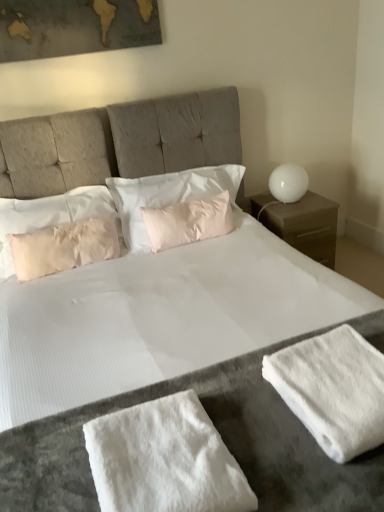
Question: Should I look upward or downward to see pink textured pillow at center, which is the 3th pillow from left to right?

Choices:
 (A) up
 (B) down

Answer: (A)

Question: Should I look upward or downward to see white matte table lamp at right?

Choices:
 (A) down
 (B) up

Answer: (B)

Question: Is white matte nightstand at right at the right side of pink fabric pillow at upper left, placed as the third pillow when sorted from right to left?

Choices:
 (A) yes
 (B) no

Answer: (A)

Question: Is white matte nightstand at right positioned behind pink fabric pillow at upper left, which is the first pillow in left-to-right order?

Choices:
 (A) yes
 (B) no

Answer: (A)

Question: Would you consider white matte nightstand at right to be distant from pink fabric pillow at upper left, placed as the third pillow when sorted from right to left?

Choices:
 (A) no
 (B) yes

Answer: (B)

Question: Is white matte nightstand at right closer to camera compared to pink fabric pillow at upper left, which is the first pillow in left-to-right order?

Choices:
 (A) no
 (B) yes

Answer: (A)

Question: Is white matte nightstand at right smaller than pink fabric pillow at upper left, placed as the third pillow when sorted from right to left?

Choices:
 (A) no
 (B) yes

Answer: (A)

Question: From a real-world perspective, is white matte nightstand at right located beneath pink fabric pillow at upper left, which is the first pillow in left-to-right order?

Choices:
 (A) yes
 (B) no

Answer: (A)

Question: From a real-world perspective, is white matte nightstand at right positioned under pink textured pillow at center, which is the 3th pillow from left to right, based on gravity?

Choices:
 (A) yes
 (B) no

Answer: (A)

Question: Considering the relative sizes of white matte nightstand at right and pink textured pillow at center, the first pillow when ordered from right to left, in the image provided, is white matte nightstand at right smaller than pink textured pillow at center, the first pillow when ordered from right to left,?

Choices:
 (A) yes
 (B) no

Answer: (B)

Question: Considering the relative sizes of white matte nightstand at right and pink textured pillow at center, the first pillow when ordered from right to left, in the image provided, is white matte nightstand at right thinner than pink textured pillow at center, the first pillow when ordered from right to left,?

Choices:
 (A) no
 (B) yes

Answer: (A)

Question: From a real-world perspective, is white matte nightstand at right physically above pink textured pillow at center, the first pillow when ordered from right to left?

Choices:
 (A) yes
 (B) no

Answer: (B)

Question: Can you confirm if white matte nightstand at right is bigger than pink textured pillow at center, the first pillow when ordered from right to left?

Choices:
 (A) no
 (B) yes

Answer: (B)

Question: Can you see white matte nightstand at right touching pink textured pillow at center, the first pillow when ordered from right to left?

Choices:
 (A) no
 (B) yes

Answer: (A)

Question: Is pink textured pillow at center, which is the 3th pillow from left to right, turned away from pink satin pillow at center, which is the 2th pillow from left to right?

Choices:
 (A) yes
 (B) no

Answer: (A)